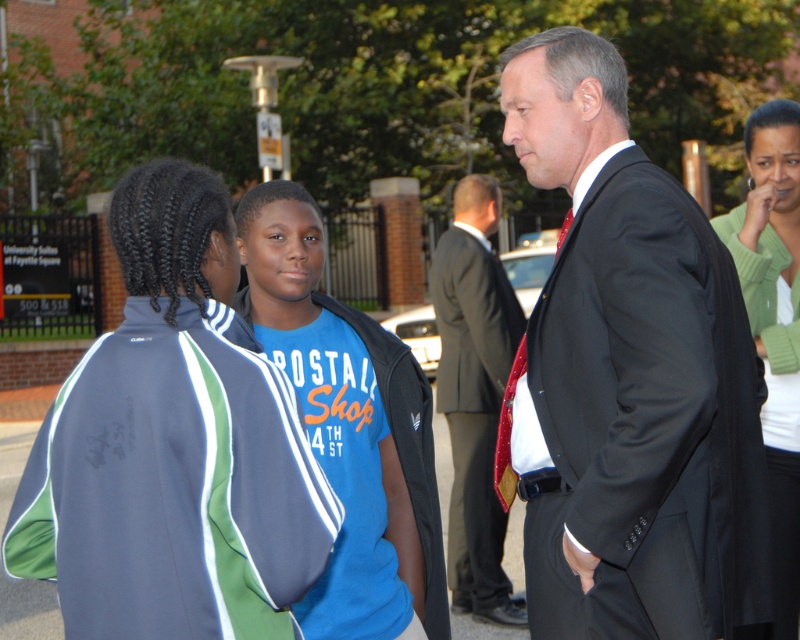
Does shiny black suit at center appear on the left side of blue cotton shirt at center?

Incorrect, shiny black suit at center is not on the left side of blue cotton shirt at center.

Between shiny black suit at center and blue cotton shirt at center, which one is positioned lower?

blue cotton shirt at center is lower down.

Locate an element on the screen. Image resolution: width=800 pixels, height=640 pixels. shiny black suit at center is located at coordinates click(x=633, y=378).

Consider the image. Is blue fleece jacket at center above green sweater at upper right?

No, blue fleece jacket at center is not above green sweater at upper right.

Is blue fleece jacket at center to the right of green sweater at upper right from the viewer's perspective?

Incorrect, blue fleece jacket at center is not on the right side of green sweater at upper right.

Describe the element at coordinates (174, 445) in the screenshot. I see `blue fleece jacket at center` at that location.

You are a GUI agent. You are given a task and a screenshot of the screen. Output one action in this format:
    pyautogui.click(x=<x>, y=<y>)
    Task: Click on the blue fleece jacket at center
    This screenshot has height=640, width=800.
    Given the screenshot: What is the action you would take?
    pyautogui.click(x=174, y=445)

Does shiny black suit at center appear on the left side of dark suit at center?

Incorrect, shiny black suit at center is not on the left side of dark suit at center.

Is shiny black suit at center bigger than dark suit at center?

Yes.

Locate an element on the screen. shiny black suit at center is located at coordinates (633, 378).

You are a GUI agent. You are given a task and a screenshot of the screen. Output one action in this format:
    pyautogui.click(x=<x>, y=<y>)
    Task: Click on the shiny black suit at center
    The width and height of the screenshot is (800, 640).
    Given the screenshot: What is the action you would take?
    pyautogui.click(x=633, y=378)